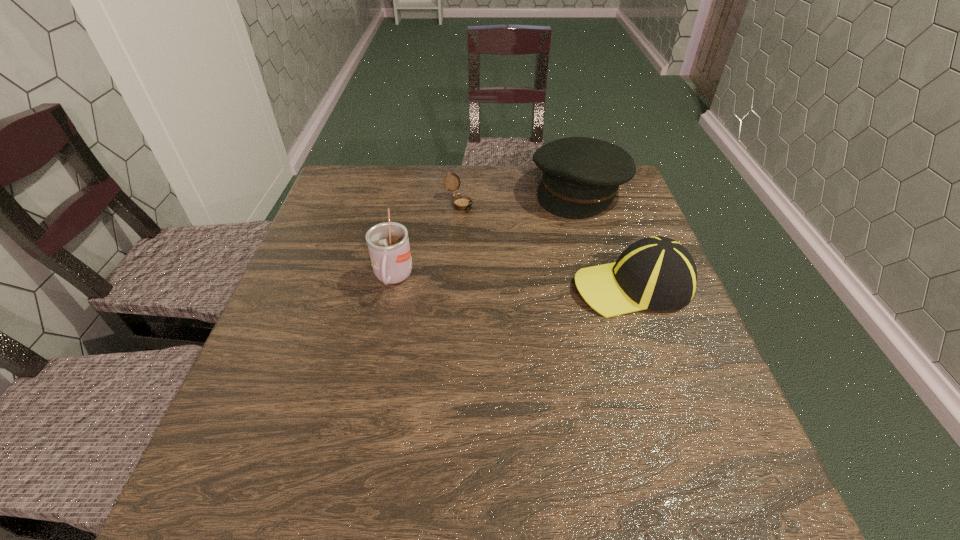
The image size is (960, 540). Find the location of `free region at the far edge of the desktop`. free region at the far edge of the desktop is located at coordinates (468, 181).

The image size is (960, 540). I want to click on vacant area at the near edge of the desktop, so click(x=407, y=403).

This screenshot has height=540, width=960. In the image, there is a desktop. Find the location of `vacant area at the left edge`. vacant area at the left edge is located at coordinates (324, 268).

Locate an element on the screen. The width and height of the screenshot is (960, 540). vacant space at the right edge of the desktop is located at coordinates (674, 342).

The image size is (960, 540). In order to click on free location at the far left corner of the desktop in this screenshot , I will do `click(341, 200)`.

The image size is (960, 540). In order to click on free space at the near left corner in this screenshot , I will do `click(242, 411)`.

I want to click on empty space that is in between the baseball cap and the shortest object, so click(x=546, y=244).

Find the location of a particular element. Image resolution: width=960 pixels, height=540 pixels. free space between the cup and the baseball cap is located at coordinates (513, 282).

What are the coordinates of `free space between the compass and the beret` in the screenshot? It's located at (519, 196).

Identify the location of empty location between the baseball cap and the beret. This screenshot has width=960, height=540. (606, 238).